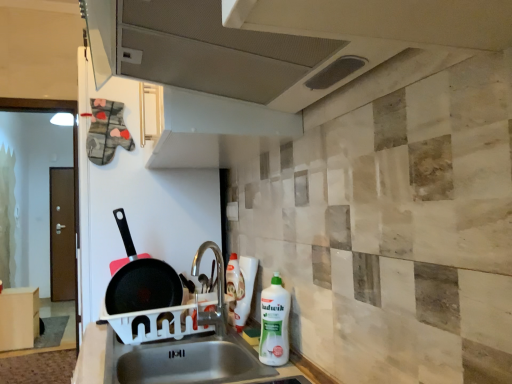
Question: Is white glossy bottle at center in front of metallic gray exhaust hood at upper center?

Choices:
 (A) no
 (B) yes

Answer: (A)

Question: Does white glossy bottle at center have a lesser width compared to metallic gray exhaust hood at upper center?

Choices:
 (A) no
 (B) yes

Answer: (B)

Question: Does white glossy bottle at center have a lesser height compared to metallic gray exhaust hood at upper center?

Choices:
 (A) yes
 (B) no

Answer: (B)

Question: Can you confirm if white glossy bottle at center is wider than metallic gray exhaust hood at upper center?

Choices:
 (A) no
 (B) yes

Answer: (A)

Question: From the image's perspective, is white glossy bottle at center on top of metallic gray exhaust hood at upper center?

Choices:
 (A) yes
 (B) no

Answer: (B)

Question: Is white glossy bottle at center bigger than metallic gray exhaust hood at upper center?

Choices:
 (A) yes
 (B) no

Answer: (B)

Question: Considering the relative sizes of light wood/wooden cabinet at lower left and white plastic bottle at lower right in the image provided, is light wood/wooden cabinet at lower left smaller than white plastic bottle at lower right?

Choices:
 (A) yes
 (B) no

Answer: (B)

Question: Is white plastic bottle at lower right at the back of light wood/wooden cabinet at lower left?

Choices:
 (A) no
 (B) yes

Answer: (A)

Question: Can you confirm if light wood/wooden cabinet at lower left is thinner than white plastic bottle at lower right?

Choices:
 (A) yes
 (B) no

Answer: (B)

Question: Is white plastic bottle at lower right surrounded by light wood/wooden cabinet at lower left?

Choices:
 (A) yes
 (B) no

Answer: (B)

Question: Is light wood/wooden cabinet at lower left positioned behind white plastic bottle at lower right?

Choices:
 (A) yes
 (B) no

Answer: (A)

Question: From the image's perspective, is light wood/wooden cabinet at lower left on top of white plastic bottle at lower right?

Choices:
 (A) no
 (B) yes

Answer: (A)

Question: Can you confirm if white plastic sink at lower center is wider than non-stick black frying pan at left?

Choices:
 (A) yes
 (B) no

Answer: (A)